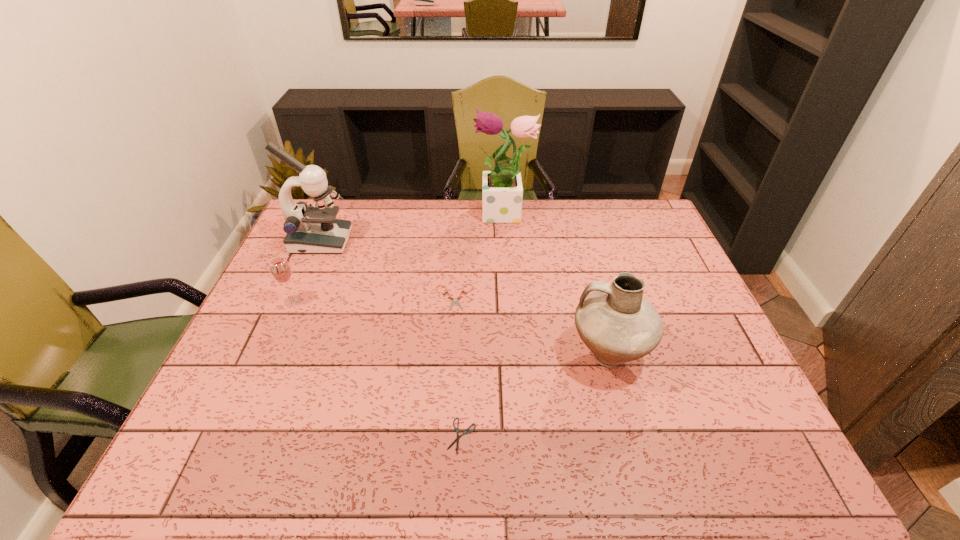
Where is `free point between the wineglass and the shortest object`? The height and width of the screenshot is (540, 960). free point between the wineglass and the shortest object is located at coordinates (377, 368).

I want to click on vacant space in between the rightmost object and the second shortest object, so click(x=531, y=327).

The image size is (960, 540). In order to click on empty location between the pitcher and the farther shears in this screenshot , I will do (531, 327).

The height and width of the screenshot is (540, 960). In order to click on free spot between the nearer shears and the wineglass in this screenshot , I will do `click(377, 368)`.

The width and height of the screenshot is (960, 540). I want to click on empty location between the flower arrangement and the wineglass, so click(398, 258).

This screenshot has height=540, width=960. What are the coordinates of `vacant space that's between the shortest object and the second nearest object` in the screenshot? It's located at (535, 395).

At what (x,y) coordinates should I click in order to perform the action: click on free point between the flower arrangement and the nearer shears. Please return your answer as a coordinate pair (x, y). The width and height of the screenshot is (960, 540). Looking at the image, I should click on (483, 325).

The width and height of the screenshot is (960, 540). Find the location of `free space between the nearest object and the microscope`. free space between the nearest object and the microscope is located at coordinates (391, 339).

Find the location of a particular element. The height and width of the screenshot is (540, 960). empty space that is in between the taller shears and the wineglass is located at coordinates (373, 299).

This screenshot has height=540, width=960. I want to click on object that stands as the closest to the third tallest object, so point(465,432).